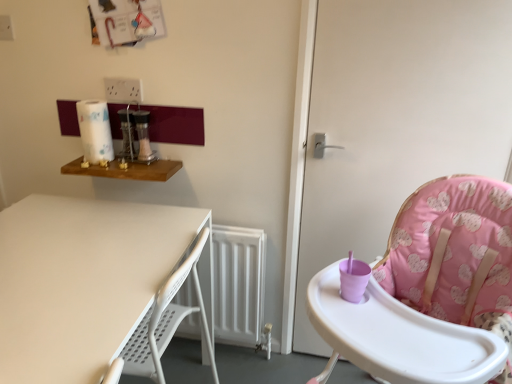
Find the location of a particular element. Image resolution: width=512 pixels, height=384 pixels. blank space situated above wooden shelf at upper left, which ranks as the 1th table in top-to-bottom order (from a real-world perspective) is located at coordinates (122, 163).